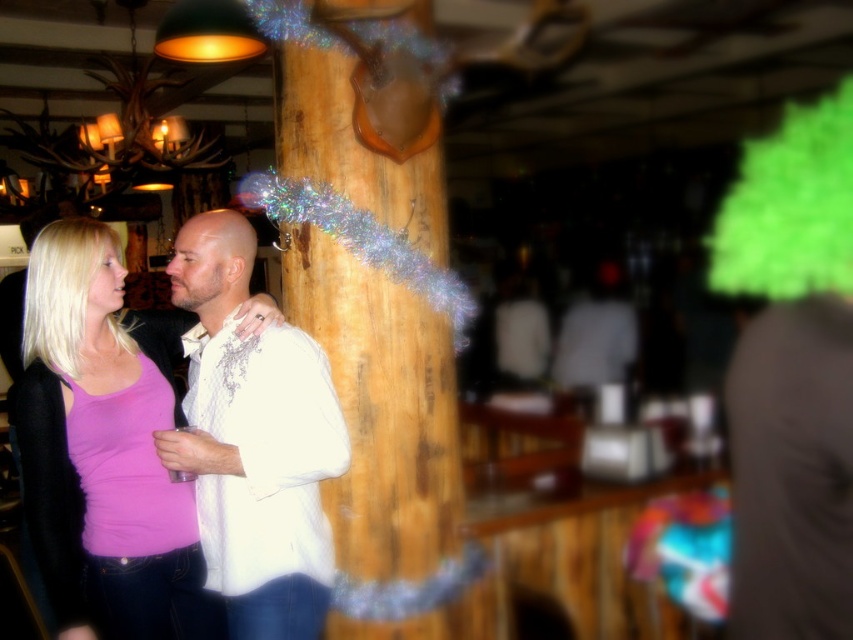
Question: Is green fuzzy wig at upper right bigger than blonde hair at left?

Choices:
 (A) no
 (B) yes

Answer: (B)

Question: In this image, where is green fuzzy wig at upper right located relative to blonde hair at left?

Choices:
 (A) below
 (B) above

Answer: (B)

Question: Which of these objects is positioned closest to the white satin shirt at center?

Choices:
 (A) green fuzzy wig at upper right
 (B) pink fabric tank top at center

Answer: (B)

Question: Which point appears closest to the camera in this image?

Choices:
 (A) (759, 273)
 (B) (94, 497)

Answer: (B)

Question: Which of the following is the closest to the observer?

Choices:
 (A) (374, 332)
 (B) (815, 204)
 (C) (49, 268)
 (D) (57, 360)

Answer: (C)

Question: Where is white satin shirt at center located in relation to green fuzzy wig at upper right in the image?

Choices:
 (A) right
 (B) left

Answer: (B)